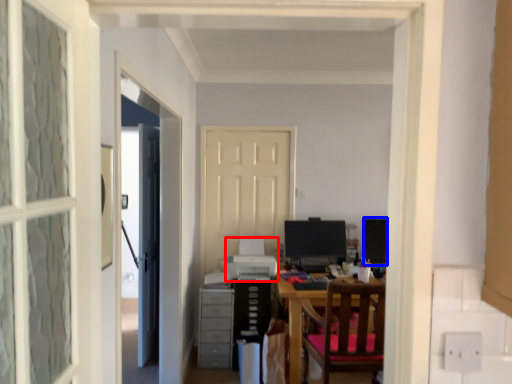
Question: Which of the following is the farthest to the observer, printer (highlighted by a red box) or computer monitor (highlighted by a blue box)?

Choices:
 (A) printer
 (B) computer monitor

Answer: (B)